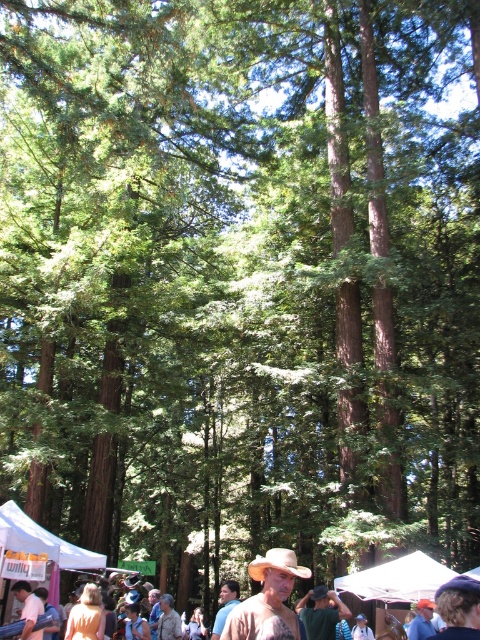
Does brown leather hat at lower center have a smaller size compared to brown felt cowboy hat at center?

No.

Who is more forward, (0,560) or (286,563)?

Positioned in front is point (286,563).

At what (x,y) coordinates should I click in order to perform the action: click on brown leather hat at lower center. Please return your answer as a coordinate pair (x, y). The image size is (480, 640). Looking at the image, I should click on (23, 566).

Which is in front, point (29, 545) or point (286, 550)?

Point (286, 550)

Is white fabric canopy at lower left to the right of brown felt cowboy hat at center from the viewer's perspective?

In fact, white fabric canopy at lower left is to the left of brown felt cowboy hat at center.

What do you see at coordinates (43, 540) in the screenshot? Image resolution: width=480 pixels, height=640 pixels. I see `white fabric canopy at lower left` at bounding box center [43, 540].

Identify the location of white fabric canopy at lower left. point(43,540).

From the picture: Between brown leather hat at lower center and brown leather hat at center, which one is positioned lower?

brown leather hat at lower center

Does point (228, 595) lie in front of point (326, 604)?

Yes, point (228, 595) is closer to viewer.

Where is `brown leather hat at lower center`? This screenshot has height=640, width=480. brown leather hat at lower center is located at coordinates (23, 566).